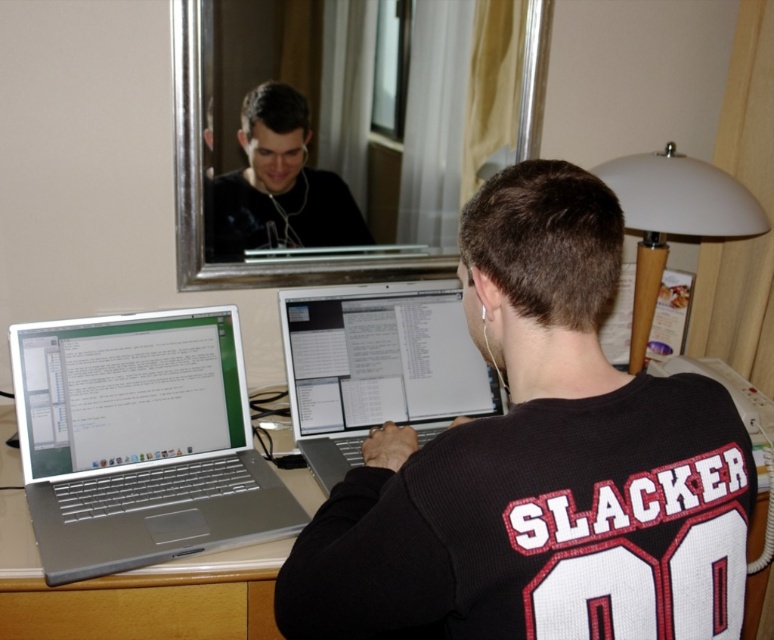
You are standing in front of the desk and want to reach the point at coordinates (478, 292). The desk is 36 inches wide. Can you reach that point without moving your body?

The distance between you and the point at coordinates (478, 292) is 35.92 inches. Since the desk is 36 inches wide, you can just barely reach the point without moving your body.

In the scene shown: You are an interior designer assessing the desk setup. The matte black shirt at upper center and the wooden drawer at lower center are both visible in the reflection of the mirror behind the person. Which object appears larger in the reflection?

The matte black shirt at upper center appears larger in the reflection than the wooden drawer at lower center because it is bigger in size.

What are the coordinates of the black jersey at center in the image?

The black jersey at center is located at coordinates point (538, 465).